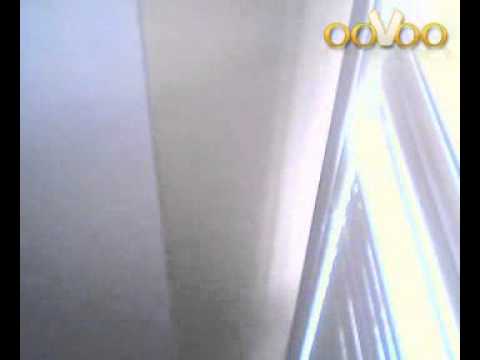
Where is `glass`? This screenshot has width=480, height=360. glass is located at coordinates (418, 296).